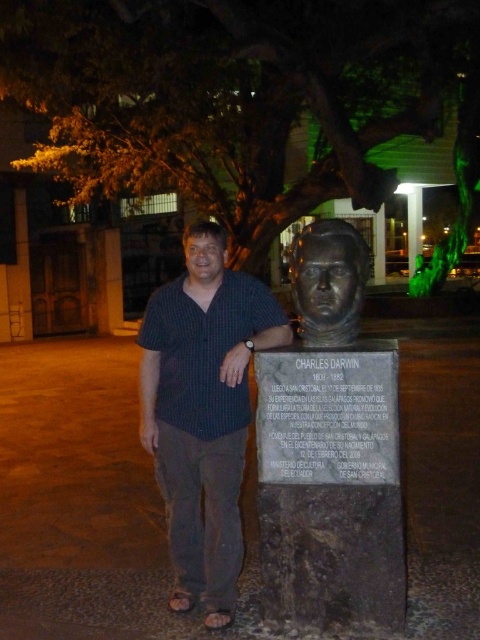
Question: Considering the relative positions of dark blue shirt at center and bronze statue at center in the image provided, where is dark blue shirt at center located with respect to bronze statue at center?

Choices:
 (A) above
 (B) below

Answer: (B)

Question: Is bronze bust at center positioned before bronze statue at center?

Choices:
 (A) yes
 (B) no

Answer: (A)

Question: Can you confirm if bronze bust at center is wider than dark blue checkered shirt at center?

Choices:
 (A) yes
 (B) no

Answer: (B)

Question: Among these points, which one is farthest from the camera?

Choices:
 (A) (354, 589)
 (B) (172, 348)

Answer: (B)

Question: Which point is closer to the camera taking this photo?

Choices:
 (A) (321, 426)
 (B) (168, 321)
 (C) (240, 384)
 (D) (312, 227)

Answer: (A)

Question: Which object is the closest to the dark blue checkered shirt at center?

Choices:
 (A) dark blue shirt at center
 (B) bronze statue at center

Answer: (A)